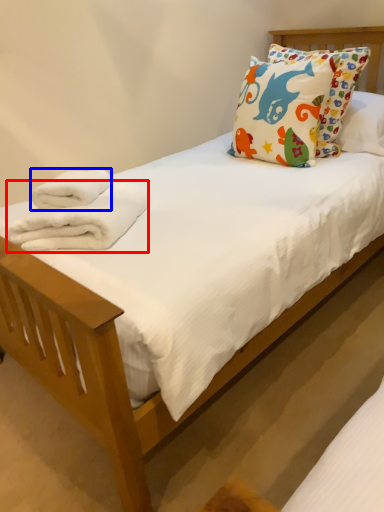
Question: Which point is closer to the camera, bath towel (highlighted by a red box) or bath towel (highlighted by a blue box)?

Choices:
 (A) bath towel
 (B) bath towel

Answer: (A)